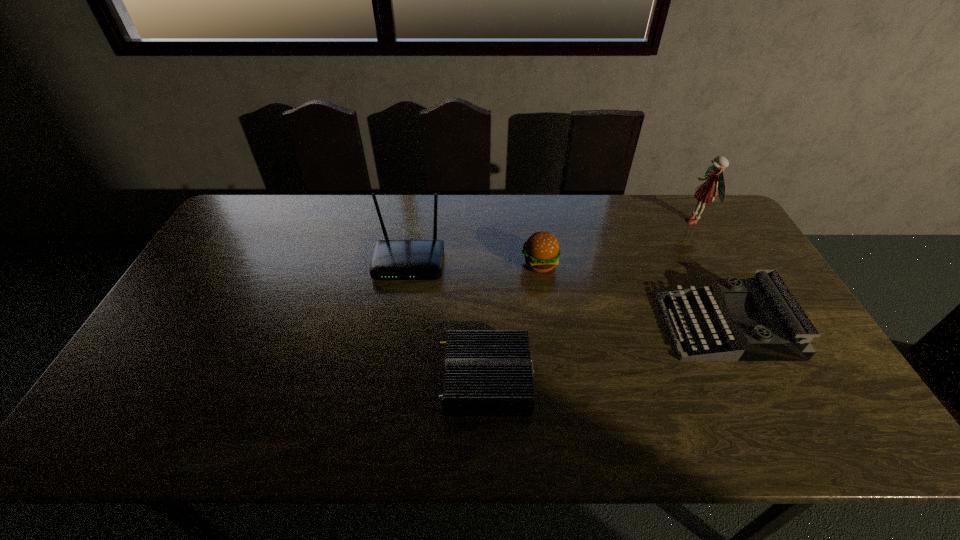
Where is `the farthest object`? The height and width of the screenshot is (540, 960). the farthest object is located at coordinates (705, 193).

The image size is (960, 540). Identify the location of the tallest object. (705, 193).

Find the location of a particular element. Image resolution: width=960 pixels, height=540 pixels. the left router is located at coordinates [392, 259].

I want to click on the fourth shortest object, so click(392, 259).

What are the coordinates of `hamburger` in the screenshot? It's located at (542, 251).

Find the location of `typewriter`. typewriter is located at coordinates (788, 339).

The width and height of the screenshot is (960, 540). Identify the location of the shortest object. (487, 372).

This screenshot has width=960, height=540. Identify the location of the nearer router. (487, 372).

You are a GUI agent. You are given a task and a screenshot of the screen. Output one action in this format:
    pyautogui.click(x=<x>, y=<y>)
    Task: Click on the vacant region located 0.360m on the front-facing side of the farthest object
    The height and width of the screenshot is (540, 960).
    Given the screenshot: What is the action you would take?
    pyautogui.click(x=581, y=221)

You are a GUI agent. You are given a task and a screenshot of the screen. Output one action in this format:
    pyautogui.click(x=<x>, y=<y>)
    Task: Click on the vacant space located on the front-facing side of the farthest object
    
    Given the screenshot: What is the action you would take?
    pyautogui.click(x=630, y=221)